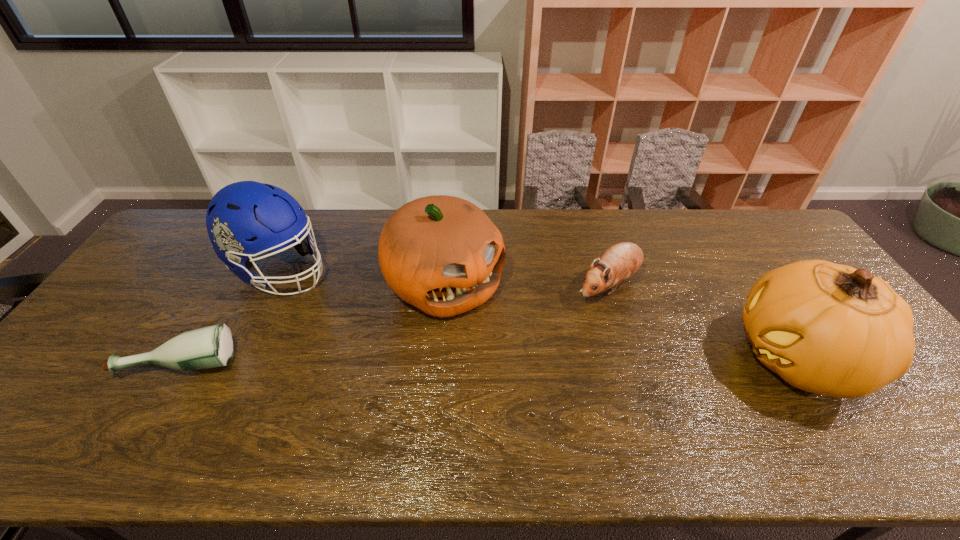
At what (x,y) coordinates should I click in order to perform the action: click on free spot between the football helmet and the rightmost object. Please return your answer as a coordinate pair (x, y). This screenshot has width=960, height=540. Looking at the image, I should click on (540, 314).

Where is `free space between the football helmet and the third object from right to left`? The height and width of the screenshot is (540, 960). free space between the football helmet and the third object from right to left is located at coordinates (363, 277).

I want to click on free spot between the bottle and the football helmet, so click(x=231, y=316).

Identify the location of vacant space in between the shortest object and the second shortest object. (396, 325).

Find the location of a particular element. Image resolution: width=960 pixels, height=540 pixels. free spot between the shortest object and the football helmet is located at coordinates (231, 316).

The image size is (960, 540). I want to click on vacant area that lies between the fourth tallest object and the right pumpkin, so click(704, 322).

Locate an element on the screen. object that is the third closest to the second object from right to left is located at coordinates (244, 219).

This screenshot has height=540, width=960. What are the coordinates of `object identified as the third closest to the football helmet` in the screenshot? It's located at (620, 261).

The height and width of the screenshot is (540, 960). In order to click on vacant point that satisfies the following two spatial constraints: 1. on the front side of the rightmost object; 2. on the front face of the hamster in this screenshot , I will do pos(632,358).

Locate an element on the screen. free region that satisfies the following two spatial constraints: 1. on the back side of the rightmost object; 2. on the front face of the bottle is located at coordinates (184, 358).